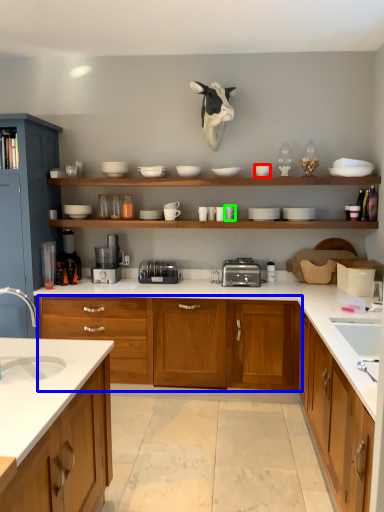
Question: Which object is the farthest from tableware (highlighted by a red box)? Choose among these: cabinetry (highlighted by a blue box) or tableware (highlighted by a green box).

Choices:
 (A) cabinetry
 (B) tableware

Answer: (A)